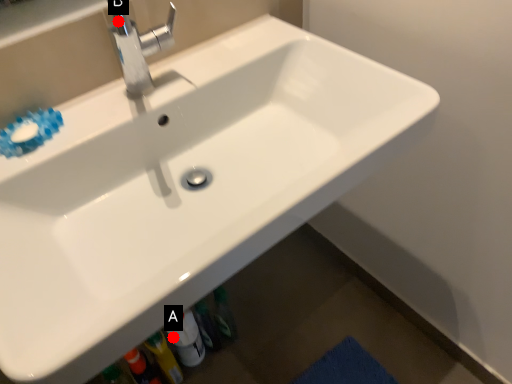
Question: Two points are circled on the image, labeled by A and B beside each circle. Among these points, which one is nearest to the camera?

Choices:
 (A) A is closer
 (B) B is closer

Answer: (B)